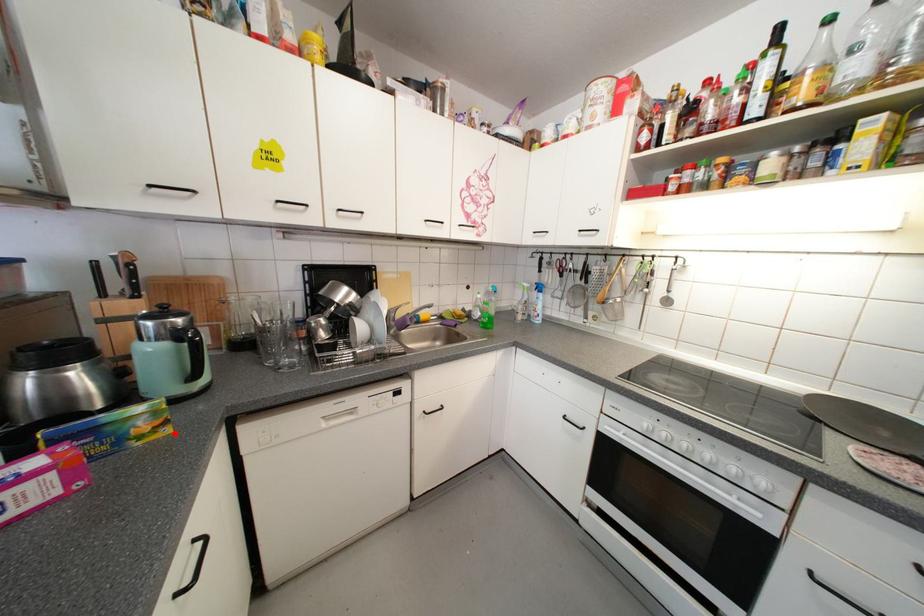
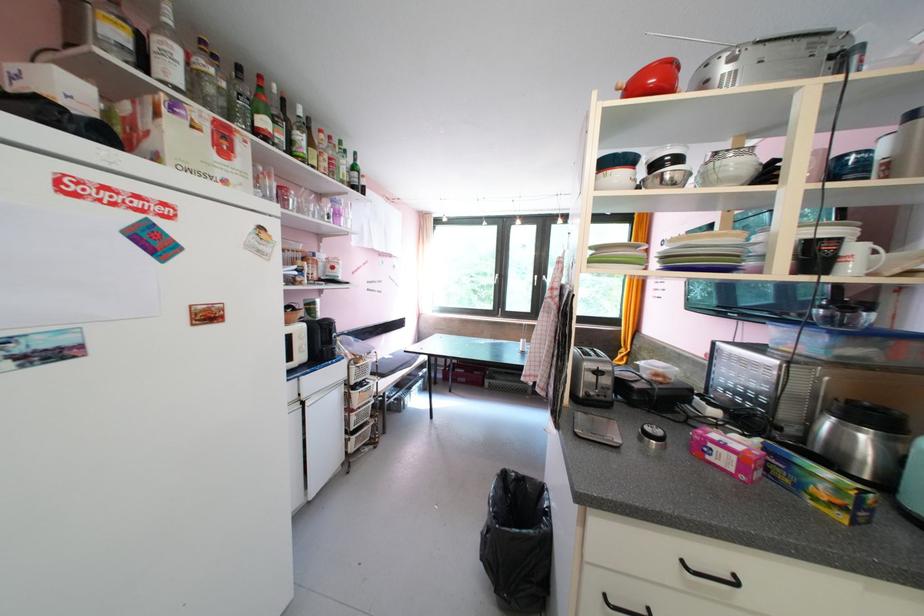
Locate, in the second image, the point that corresponds to the highlighted location in the first image.

(849, 519)